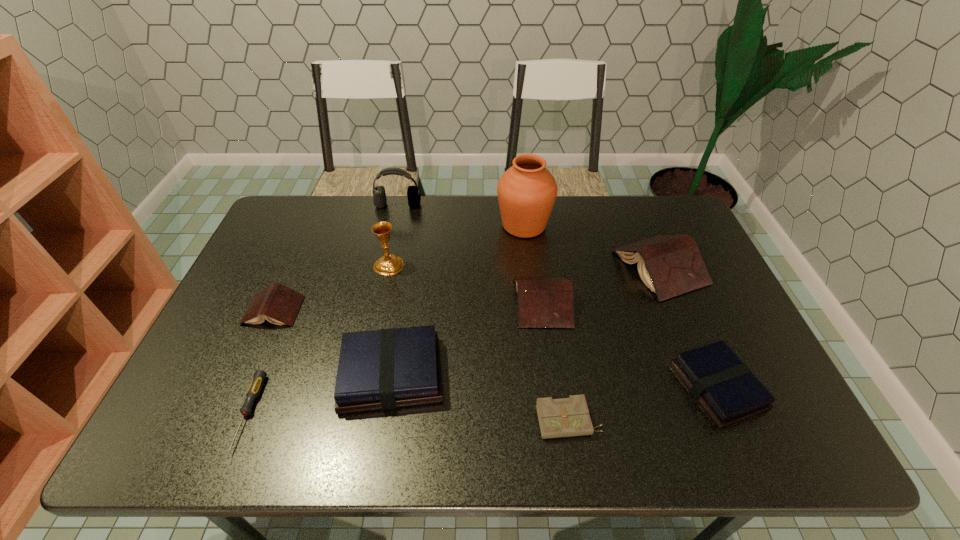
The height and width of the screenshot is (540, 960). Find the location of `unoccupied area between the diary and the biggest brown book`. unoccupied area between the diary and the biggest brown book is located at coordinates (614, 343).

Point out which object is positioned as the third nearest to the gold chalice. Please provide its 2D coordinates. Your answer should be formatted as a tuple, i.e. [(x, y)], where the tuple contains the x and y coordinates of a point satisfying the conditions above.

[(379, 199)]

In order to click on the eighth closest object to the tallest book in this screenshot , I will do `click(278, 304)`.

Image resolution: width=960 pixels, height=540 pixels. I want to click on the closest book to the leftmost brown book, so click(x=383, y=369).

Locate an element on the screen. The image size is (960, 540). book object that ranks as the second closest to the right blue book is located at coordinates (543, 302).

Identify which brown book is located as the second nearest to the ninth tallest object. Please provide its 2D coordinates. Your answer should be formatted as a tuple, i.e. [(x, y)], where the tuple contains the x and y coordinates of a point satisfying the conditions above.

[(670, 265)]

Select which brown book appears as the closest to the second brown book from right to left. Please provide its 2D coordinates. Your answer should be formatted as a tuple, i.e. [(x, y)], where the tuple contains the x and y coordinates of a point satisfying the conditions above.

[(670, 265)]

This screenshot has height=540, width=960. What are the coordinates of `free space that satisfies the following two spatial constraints: 1. on the headband of the headset; 2. on the left side of the bigger blue book` in the screenshot? It's located at (360, 374).

Find the location of a particular element. The width and height of the screenshot is (960, 540). vacant space that satisfies the following two spatial constraints: 1. on the headband of the rightmost brown book; 2. on the left side of the black headset is located at coordinates coord(384,267).

Locate an element on the screen. The image size is (960, 540). free spot that satisfies the following two spatial constraints: 1. on the headband of the black headset; 2. on the left side of the tallest book is located at coordinates (384, 267).